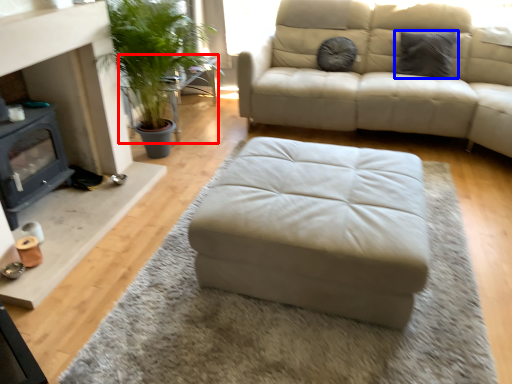
Question: Which object is further to the camera taking this photo, table (highlighted by a red box) or pillow (highlighted by a blue box)?

Choices:
 (A) table
 (B) pillow

Answer: (A)